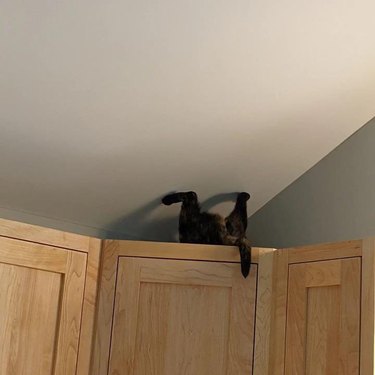
Identify the location of shadow on ceiling. Image resolution: width=375 pixels, height=375 pixels. (75, 183).